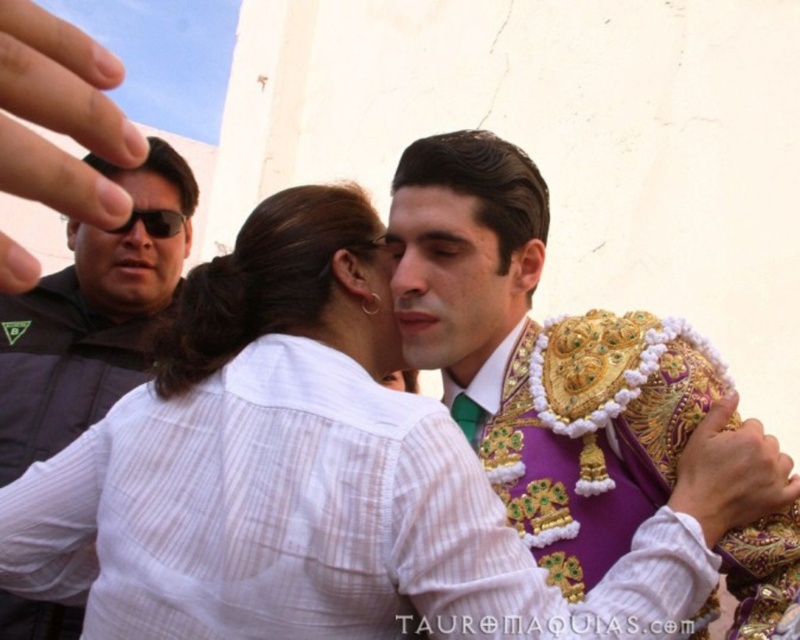
You are an event organizer planning to seat the purple velvet vest at center and the black matte jacket at left side by side. Given their sizes, which one requires more space between them and the next seat?

The purple velvet vest at center requires more space between it and the next seat because its width is larger than the black matte jacket at left.

You are a photographer at the event and want to capture a photo of both the purple velvet vest at center and the black matte jacket at left in the same frame. Given that your camera has a maximum focal length that allows capturing objects up to 25 meters apart in a single shot, will you be able to include both in the frame?

The purple velvet vest at center and the black matte jacket at left are 26.57 meters apart, which exceeds the camera maximum focal length of 25 meters. Therefore, you cannot include both in the same frame.

You are an observer at a cultural event. You notice two items of clothing in the scene described. The first is the purple velvet vest at center, and the second is the black matte jacket at left. Based on their positions, which item is closer to the bottom of the image?

The purple velvet vest at center is below the black matte jacket at left, so the purple velvet vest at center is closer to the bottom of the image.